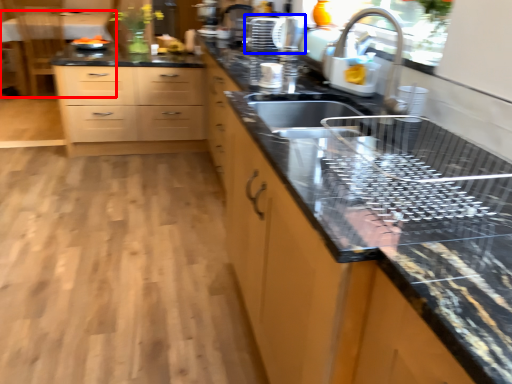
Question: Which object is closer to the camera taking this photo, table (highlighted by a red box) or appliance (highlighted by a blue box)?

Choices:
 (A) table
 (B) appliance

Answer: (B)